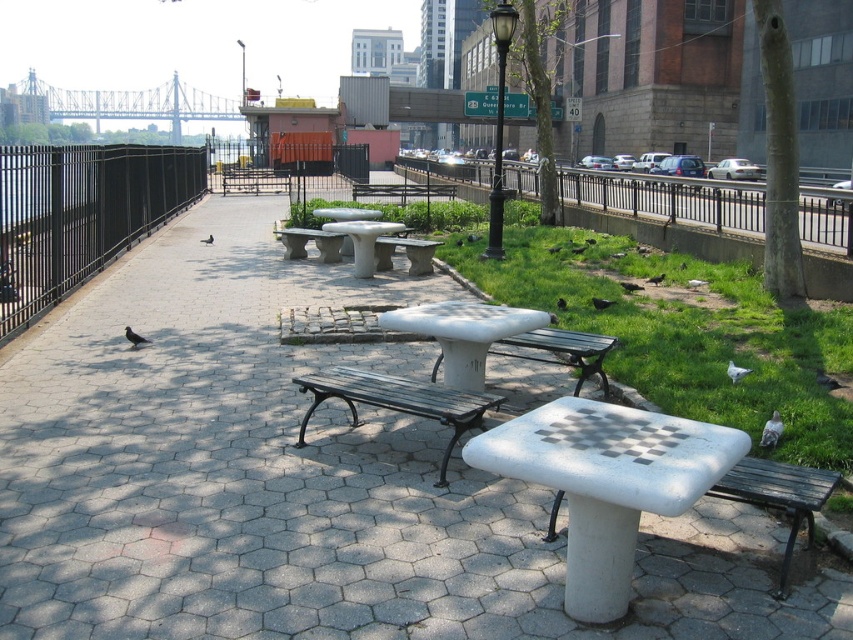
You are standing at the camera position in the park and want to reach the point labeled as point (676, 220). If you walk straight ahead, will you reach that point before walking 40 feet?

The distance between point (676, 220) and the camera is 41.61 feet. Since 41.61 feet is greater than 40 feet, you will not reach the point before walking 40 feet.

You are sitting on the grassy area to the right of the paved area and want to move to the white concrete bench at center and the black wrought iron bench at center. Which one is closer to you?

The white concrete bench at center is closer to you because it is to the left of the black wrought iron bench at center, which is further away from your current position on the grassy area to the right of the paved area.

You are planning to set up a picnic blanket in the park. You want to place it between the white concrete bench at center and the white concrete picnic table at center. Which object should you place the blanket closer to if you want it to be closer to the picnic table?

You should place the picnic blanket closer to the white concrete picnic table at center since the white concrete bench at center is on the left side of the picnic table, meaning the picnic table is on the right side of the bench. Therefore, positioning the blanket near the picnic table would place it closer to the desired location.